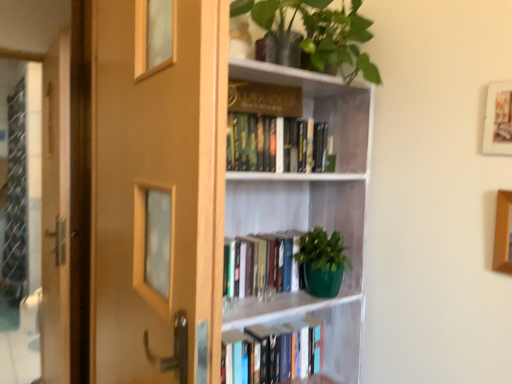
What are the coordinates of `white matte bookcase at center` in the screenshot? It's located at (298, 241).

This screenshot has height=384, width=512. Find the location of `green matte book at center, which is counted as the 2th book, starting from the bottom`. green matte book at center, which is counted as the 2th book, starting from the bottom is located at coordinates (261, 264).

Locate an element on the screen. The width and height of the screenshot is (512, 384). wooden framed picture at upper right, the 1th picture frame in the top-to-bottom sequence is located at coordinates (498, 119).

The height and width of the screenshot is (384, 512). What do you see at coordinates (498, 119) in the screenshot?
I see `wooden framed picture at upper right, the second picture frame in the bottom-to-top sequence` at bounding box center [498, 119].

I want to click on white matte bookcase at center, so click(x=298, y=241).

Consider the image. Which is more distant, (187,121) or (61,60)?

The point (61,60) is more distant.

Is wooden door at left not close to wooden screen door at left?

Actually, wooden door at left and wooden screen door at left are a little close together.

Considering the positions of objects wooden door at left and wooden screen door at left in the image provided, who is in front, wooden door at left or wooden screen door at left?

wooden door at left.

From the image's perspective, is wooden door at left located beneath wooden screen door at left?

No, from the image's perspective, wooden door at left is not beneath wooden screen door at left.

Is point (247, 93) closer or farther from the camera than point (343, 294)?

Point (247, 93).

From a real-world perspective, which object rests below the other?

From a 3D spatial view, white matte bookcase at center is below.

Between gold hardcover book at upper center, positioned as the 4th book in bottom-to-top order, and white matte bookcase at center, which one has larger width?

With larger width is white matte bookcase at center.

Which is in front, point (290, 282) or point (509, 248)?

The point (509, 248) is more forward.

Does green matte book at center, which is the 3th book from top to bottom, have a greater width compared to wooden picture frame at upper right, which is the 1th picture frame in bottom-to-top order?

Yes.

Is wooden picture frame at upper right, which is the 1th picture frame in bottom-to-top order, located within green matte book at center, which is the 3th book from top to bottom?

Definitely not — wooden picture frame at upper right, which is the 1th picture frame in bottom-to-top order, is not inside green matte book at center, which is the 3th book from top to bottom.

Is green matte book at center, which is the 3th book from top to bottom, facing away from wooden picture frame at upper right, which is the 1th picture frame in bottom-to-top order?

No, green matte book at center, which is the 3th book from top to bottom, is not facing away from wooden picture frame at upper right, which is the 1th picture frame in bottom-to-top order.

Considering the positions of objects wooden screen door at left and gold hardcover book at upper center, positioned as the 4th book in bottom-to-top order, in the image provided, who is behind, wooden screen door at left or gold hardcover book at upper center, positioned as the 4th book in bottom-to-top order,?

wooden screen door at left is further away from the camera.

Is wooden screen door at left shorter than gold hardcover book at upper center, which appears as the first book when viewed from the top?

No, wooden screen door at left is not shorter than gold hardcover book at upper center, which appears as the first book when viewed from the top.

Is gold hardcover book at upper center, positioned as the 4th book in bottom-to-top order, a part of wooden screen door at left?

That's incorrect, gold hardcover book at upper center, positioned as the 4th book in bottom-to-top order, is not inside wooden screen door at left.

The width and height of the screenshot is (512, 384). Find the location of `houseplant above the wooden screen door at left (from the image's perspective)`. houseplant above the wooden screen door at left (from the image's perspective) is located at coordinates (319, 32).

From the image's perspective, between wooden screen door at left and green matte plant at upper center, which one is located above?

green matte plant at upper center is shown above in the image.

Can you confirm if wooden screen door at left is positioned to the left of green matte plant at upper center?

Yes.

Is wooden screen door at left placed right next to green matte plant at upper center?

wooden screen door at left and green matte plant at upper center are clearly separated.

Visually, is green matte plant at upper center positioned to the left or to the right of gold hardcover book at upper center, which appears as the first book when viewed from the top?

Clearly, green matte plant at upper center is on the right of gold hardcover book at upper center, which appears as the first book when viewed from the top, in the image.

How much distance is there between green matte plant at upper center and gold hardcover book at upper center, which appears as the first book when viewed from the top?

8.98 inches.

I want to click on houseplant that is on the right side of gold hardcover book at upper center, positioned as the 4th book in bottom-to-top order, so pos(319,32).

Is green matte plant at upper center looking in the opposite direction of gold hardcover book at upper center, positioned as the 4th book in bottom-to-top order?

green matte plant at upper center does not have its back to gold hardcover book at upper center, positioned as the 4th book in bottom-to-top order.

From a real-world perspective, which object rests below the other?

wooden door at left.

From a real-world perspective, which book is the 2nd one above the wooden door at left? Please provide its 2D coordinates.

[(264, 99)]

Which point is more distant from viewer, (x=262, y=104) or (x=110, y=345)?

The point (x=262, y=104) is more distant.

Where is `screen door that appears on the left of wooden door at left`? This screenshot has width=512, height=384. screen door that appears on the left of wooden door at left is located at coordinates (56, 211).

I want to click on bookcase below the gold hardcover book at upper center, positioned as the 4th book in bottom-to-top order (from a real-world perspective), so click(x=298, y=241).

Based on their spatial positions, is green matte book at center, which is the 3th book from top to bottom, or wooden door at left further from wooden picture frame at upper right, placed as the 2th picture frame when sorted from top to bottom?

The object further to wooden picture frame at upper right, placed as the 2th picture frame when sorted from top to bottom, is wooden door at left.

Looking at the image, which one is located further to hardcover books at upper center, which is counted as the second book, starting from the top, green matte plant at upper center or hardcover book at center, acting as the 1th book starting from the bottom?

Among the two, hardcover book at center, acting as the 1th book starting from the bottom, is located further to hardcover books at upper center, which is counted as the second book, starting from the top.

Based on their spatial positions, is hardcover book at center, acting as the 1th book starting from the bottom, or wooden screen door at left closer to white matte bookcase at center?

hardcover book at center, acting as the 1th book starting from the bottom, lies closer to white matte bookcase at center than the other object.

In the scene shown: Estimate the real-world distances between objects in this image. Which object is closer to wooden picture frame at upper right, placed as the 2th picture frame when sorted from top to bottom, hardcover books at upper center, which is counted as the second book, starting from the top, or wooden screen door at left?

The object closer to wooden picture frame at upper right, placed as the 2th picture frame when sorted from top to bottom, is hardcover books at upper center, which is counted as the second book, starting from the top.

Which object lies further to the anchor point wooden picture frame at upper right, which is the 1th picture frame in bottom-to-top order, wooden screen door at left or hardcover books at upper center, which is counted as the second book, starting from the top?

The object further to wooden picture frame at upper right, which is the 1th picture frame in bottom-to-top order, is wooden screen door at left.

Looking at the image, which one is located closer to white matte bookcase at center, wooden screen door at left or gold hardcover book at upper center, which appears as the first book when viewed from the top?

gold hardcover book at upper center, which appears as the first book when viewed from the top.

From the image, which object appears to be nearer to green matte book at center, which is counted as the 2th book, starting from the bottom, wooden screen door at left or white matte bookcase at center?

Based on the image, white matte bookcase at center appears to be nearer to green matte book at center, which is counted as the 2th book, starting from the bottom.

Estimate the real-world distances between objects in this image. Which object is closer to wooden framed picture at upper right, the 1th picture frame in the top-to-bottom sequence, hardcover books at upper center, which is counted as the second book, starting from the top, or wooden door at left?

hardcover books at upper center, which is counted as the second book, starting from the top.

Locate an element on the screen. bookcase between wooden door at left and wooden picture frame at upper right, placed as the 2th picture frame when sorted from top to bottom, in the horizontal direction is located at coordinates (298, 241).

In order to click on houseplant located between wooden door at left and gold hardcover book at upper center, which appears as the first book when viewed from the top, in the depth direction in this screenshot , I will do `click(319, 32)`.

Image resolution: width=512 pixels, height=384 pixels. I want to click on door between green matte plant at upper center and hardcover book at center, which appears as the fourth book when viewed from the top, vertically, so click(x=157, y=191).

This screenshot has width=512, height=384. I want to click on bookcase situated between green matte book at center, which is counted as the 2th book, starting from the bottom, and wooden picture frame at upper right, placed as the 2th picture frame when sorted from top to bottom, from left to right, so click(x=298, y=241).